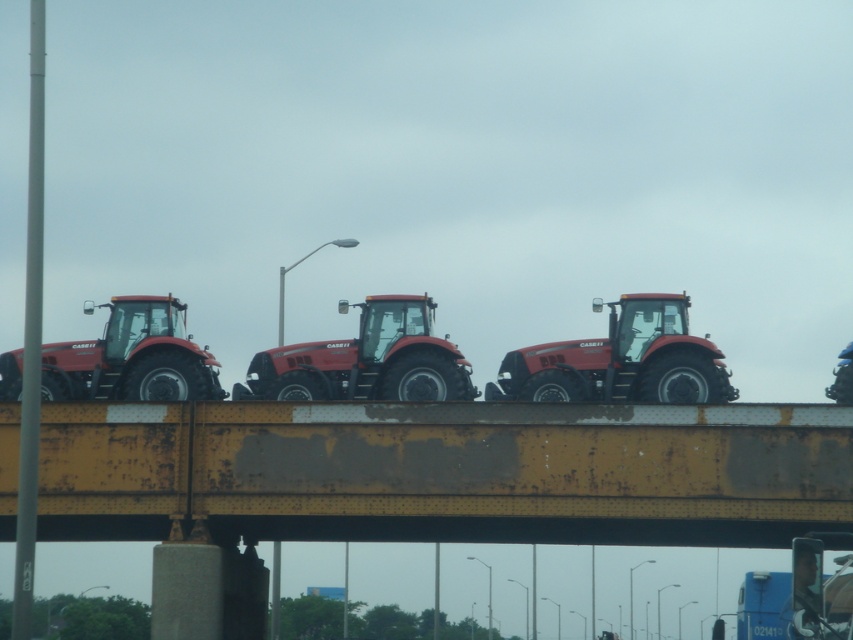
You are standing at the point labeled point (445, 472) in the image. What structure are you currently on?

The point (445, 472) indicates you are on the yellow rusted steel bridge at center.

You are a farmer who needs to transport a matte red tractor at center across the yellow rusted steel bridge at center. Given the bridge and tractor sizes, can the tractor safely cross the bridge?

The yellow rusted steel bridge at center is larger in size than the matte red tractor at center, so the tractor can safely cross the bridge as there is enough space.